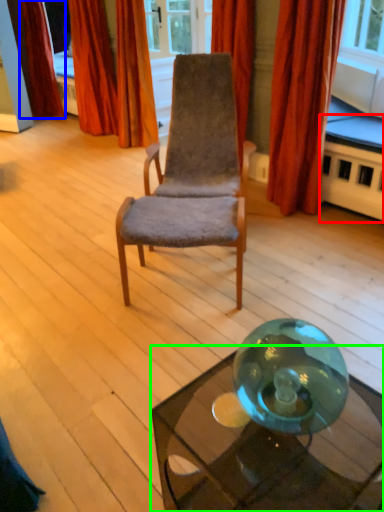
Question: Estimate the real-world distances between objects in this image. Which object is farther from table (highlighted by a red box), curtain (highlighted by a blue box) or table (highlighted by a green box)?

Choices:
 (A) curtain
 (B) table

Answer: (A)